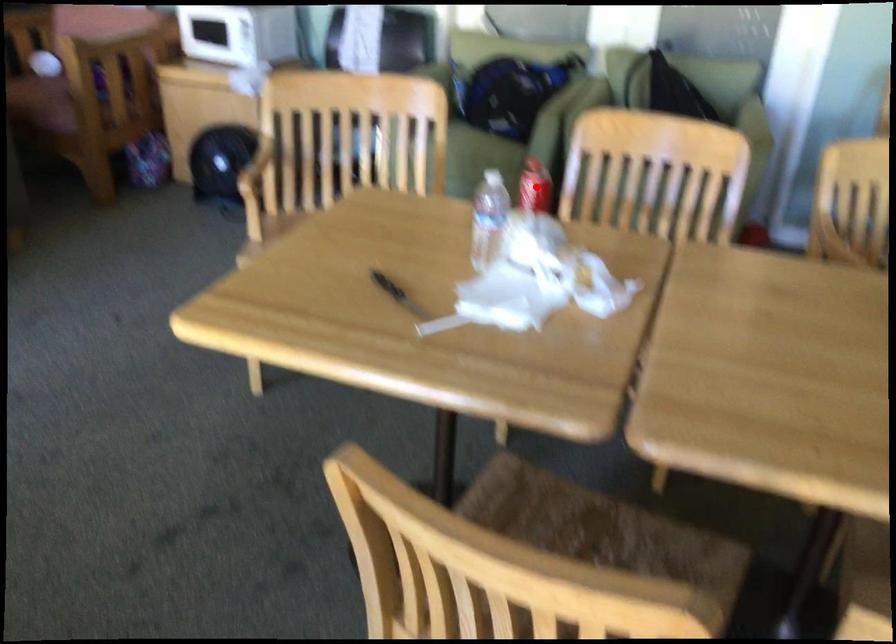
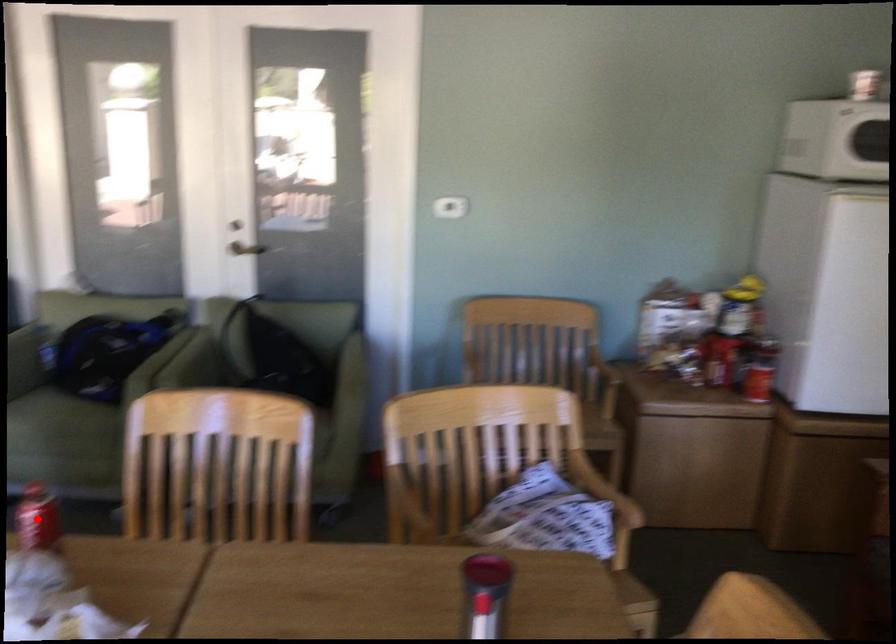
I am providing you with two images of the same scene from different viewpoints. A red point is marked on the first image and another point is marked on the second image. Do the highlighted points in image1 and image2 indicate the same real-world spot?

Yes